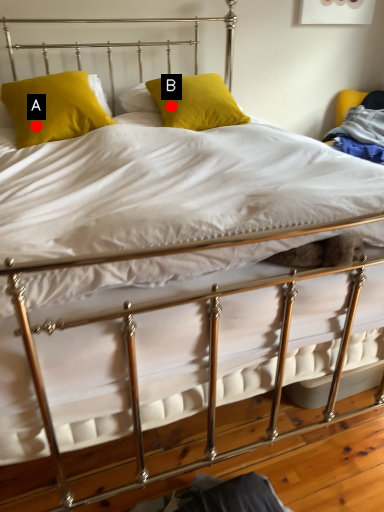
Question: Two points are circled on the image, labeled by A and B beside each circle. Which point appears closest to the camera in this image?

Choices:
 (A) A is closer
 (B) B is closer

Answer: (A)